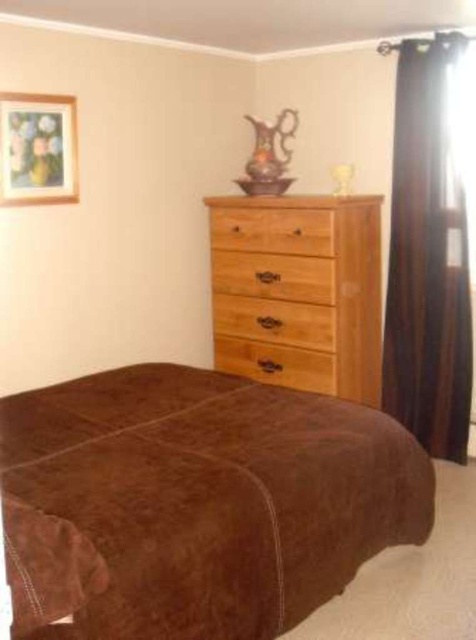
You are planning to place a new rectangular rug in the bedroom corner. The rug is 1.5 meters wide. You want to place it between the brown suede bed at center and the natural wood drawer at center. Is the space between them wide enough to fit the rug?

The brown suede bed at center is wider than the natural wood drawer at center. Therefore, the space between them is sufficient to accommodate a rug that is 1.5 meters wide.

You are planning to hang a new painting that is 1.2 meters wide. You want to place it on the wall where the framed picture is currently located. Considering the space between the black velvet curtain at right and the natural wood drawer at center, will the painting fit horizontally?

The black velvet curtain at right is larger than the natural wood drawer at center. The space between them may accommodate the 1.2 meter painting, but since the exact distance isn